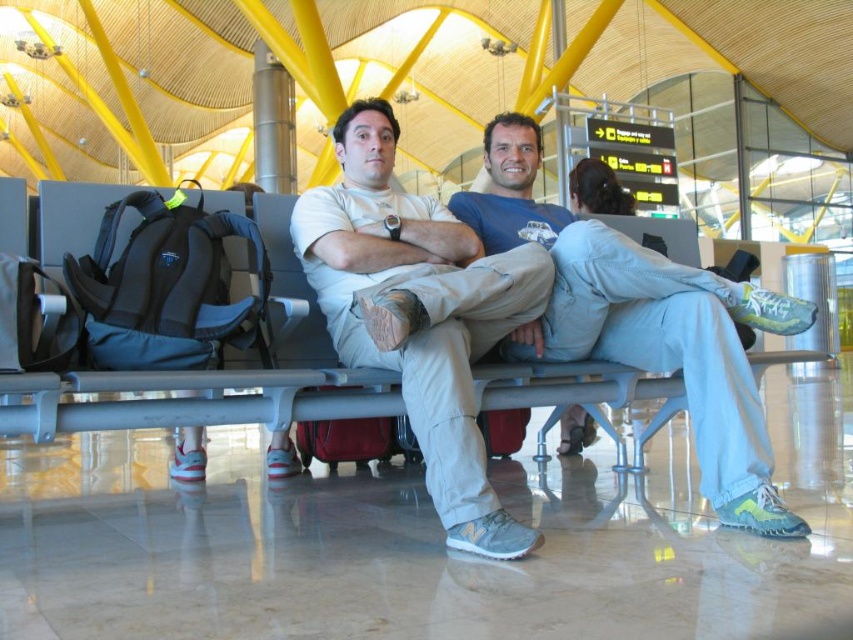
Is the position of light beige cotton pants at center less distant than that of maroon fabric suitcase at center?

Yes, it is.

Where is `light beige cotton pants at center`? The height and width of the screenshot is (640, 853). light beige cotton pants at center is located at coordinates (421, 314).

Where is `light beige cotton pants at center`? Image resolution: width=853 pixels, height=640 pixels. light beige cotton pants at center is located at coordinates (421, 314).

Does metallic gray bench at center appear on the left side of maroon fabric suitcase at center?

Indeed, metallic gray bench at center is positioned on the left side of maroon fabric suitcase at center.

At what (x,y) coordinates should I click in order to perform the action: click on metallic gray bench at center. Please return your answer as a coordinate pair (x, y). Image resolution: width=853 pixels, height=640 pixels. Looking at the image, I should click on (189, 400).

Does point (215, 403) come behind point (328, 458)?

No, it is in front of (328, 458).

The height and width of the screenshot is (640, 853). Find the location of `metallic gray bench at center`. metallic gray bench at center is located at coordinates tap(189, 400).

Does light beige cotton pants at center lie in front of metallic gray bench at center?

No, it is behind metallic gray bench at center.

The image size is (853, 640). Find the location of `light beige cotton pants at center`. light beige cotton pants at center is located at coordinates (421, 314).

Who is more forward, [373,134] or [206,422]?

Point [206,422] is more forward.

The width and height of the screenshot is (853, 640). In order to click on light beige cotton pants at center in this screenshot , I will do `click(421, 314)`.